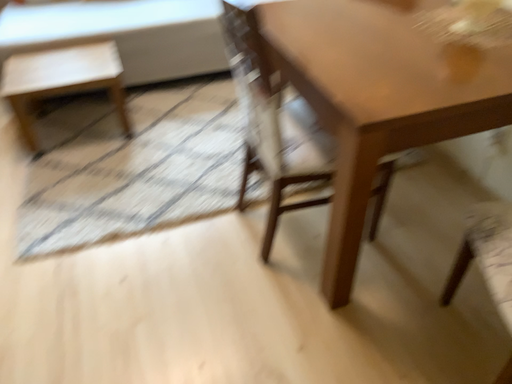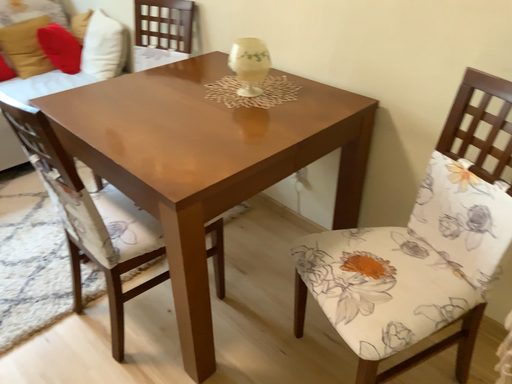
Question: How did the camera likely rotate when shooting the video?

Choices:
 (A) rotated right
 (B) rotated left

Answer: (A)